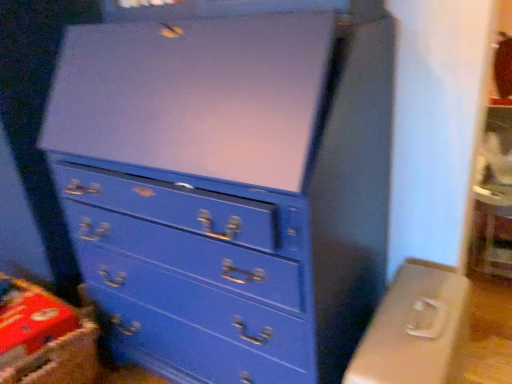
Question: Could you tell me if matte plastic computer desk at lower right is facing matte blue dresser at center?

Choices:
 (A) yes
 (B) no

Answer: (B)

Question: Considering the relative sizes of matte plastic computer desk at lower right and matte blue dresser at center in the image provided, is matte plastic computer desk at lower right bigger than matte blue dresser at center?

Choices:
 (A) yes
 (B) no

Answer: (B)

Question: Is the position of matte plastic computer desk at lower right more distant than that of matte blue dresser at center?

Choices:
 (A) no
 (B) yes

Answer: (B)

Question: Would you say matte plastic computer desk at lower right is a long distance from matte blue dresser at center?

Choices:
 (A) yes
 (B) no

Answer: (B)

Question: Is matte plastic computer desk at lower right to the right of matte blue dresser at center from the viewer's perspective?

Choices:
 (A) yes
 (B) no

Answer: (A)

Question: Based on their positions, is matte plastic computer desk at lower right located to the left or right of matte blue dresser at center?

Choices:
 (A) right
 (B) left

Answer: (A)

Question: Based on their sizes in the image, would you say matte plastic computer desk at lower right is bigger or smaller than matte blue dresser at center?

Choices:
 (A) small
 (B) big

Answer: (A)

Question: From their relative heights in the image, would you say matte plastic computer desk at lower right is taller or shorter than matte blue dresser at center?

Choices:
 (A) short
 (B) tall

Answer: (A)

Question: Is point (384, 312) closer or farther from the camera than point (328, 107)?

Choices:
 (A) closer
 (B) farther

Answer: (B)

Question: Do you think matte blue dresser at center is within red cardboard crate at lower left, or outside of it?

Choices:
 (A) inside
 (B) outside

Answer: (B)

Question: Is point (169, 243) positioned closer to the camera than point (67, 339)?

Choices:
 (A) closer
 (B) farther

Answer: (A)

Question: Considering the positions of matte blue dresser at center and red cardboard crate at lower left in the image, is matte blue dresser at center taller or shorter than red cardboard crate at lower left?

Choices:
 (A) short
 (B) tall

Answer: (B)

Question: From a real-world perspective, is matte blue dresser at center physically located above or below red cardboard crate at lower left?

Choices:
 (A) below
 (B) above

Answer: (B)

Question: Looking at the image, does red cardboard crate at lower left seem bigger or smaller compared to matte plastic computer desk at lower right?

Choices:
 (A) big
 (B) small

Answer: (B)

Question: From a real-world perspective, relative to matte plastic computer desk at lower right, is red cardboard crate at lower left vertically above or below?

Choices:
 (A) above
 (B) below

Answer: (A)